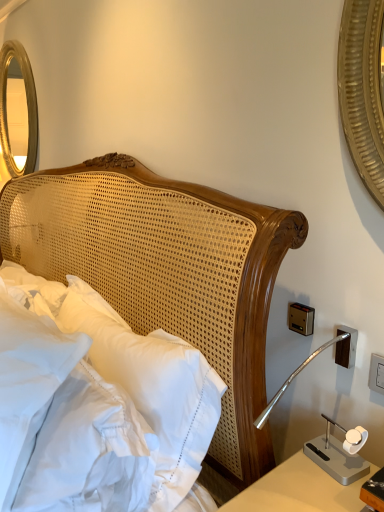
What do you see at coordinates (27, 106) in the screenshot? The height and width of the screenshot is (512, 384). I see `gold metallic mirror at upper left` at bounding box center [27, 106].

The image size is (384, 512). What do you see at coordinates (170, 273) in the screenshot?
I see `white woven headboard at center` at bounding box center [170, 273].

This screenshot has height=512, width=384. What do you see at coordinates (376, 373) in the screenshot?
I see `white plastic electric outlet at right` at bounding box center [376, 373].

At what (x,y) coordinates should I click in order to perform the action: click on gold metallic mirror at upper left. Please return your answer as a coordinate pair (x, y). Image resolution: width=384 pixels, height=512 pixels. Looking at the image, I should click on (27, 106).

Is white plastic electric outlet at right looking in the opposite direction of white woven headboard at center?

That's not correct — white plastic electric outlet at right is not looking away from white woven headboard at center.

Which object is more forward, white plastic electric outlet at right or white woven headboard at center?

white woven headboard at center is closer to the camera.

Considering the relative positions of white plastic electric outlet at right and white woven headboard at center in the image provided, is white plastic electric outlet at right to the right of white woven headboard at center from the viewer's perspective?

Correct, you'll find white plastic electric outlet at right to the right of white woven headboard at center.

Image resolution: width=384 pixels, height=512 pixels. I want to click on electric outlet behind the white woven headboard at center, so click(x=376, y=373).

Is white soft pillow at left bigger than gold metallic mirror at upper left?

Yes, white soft pillow at left is bigger than gold metallic mirror at upper left.

Is white soft pillow at left positioned before gold metallic mirror at upper left?

Yes, white soft pillow at left is closer to the viewer.

Is white soft pillow at left facing away from gold metallic mirror at upper left?

white soft pillow at left does not have its back to gold metallic mirror at upper left.

From a real-world perspective, who is located higher, white woven headboard at center or white soft pillow at left?

white soft pillow at left.

Considering the relative sizes of white woven headboard at center and white soft pillow at left in the image provided, is white woven headboard at center taller than white soft pillow at left?

Correct, white woven headboard at center is much taller as white soft pillow at left.

Is white woven headboard at center far away from white soft pillow at left?

No, white woven headboard at center is not far away from white soft pillow at left.

Considering the sizes of objects white woven headboard at center and white soft pillow at left in the image provided, who is wider, white woven headboard at center or white soft pillow at left?

With larger width is white woven headboard at center.

From the picture: Would you say white soft pillow at left is inside or outside white woven headboard at center?

white soft pillow at left cannot be found inside white woven headboard at center.

Is point (46, 317) positioned in front of point (237, 313)?

No, it is behind (237, 313).

Can you confirm if white soft pillow at left is thinner than white woven headboard at center?

Correct, the width of white soft pillow at left is less than that of white woven headboard at center.

Which is more to the left, white soft pillow at left or white woven headboard at center?

white soft pillow at left.

How far apart are white plastic electric outlet at right and gold metallic mirror at upper left?

8.16 feet.

Is white plastic electric outlet at right taller than gold metallic mirror at upper left?

Incorrect, the height of white plastic electric outlet at right is not larger of that of gold metallic mirror at upper left.

Which is more to the right, white plastic electric outlet at right or gold metallic mirror at upper left?

white plastic electric outlet at right is more to the right.

Between white plastic electric outlet at right and gold metallic mirror at upper left, which one is positioned in front?

white plastic electric outlet at right is in front.

Between gold metallic mirror at upper left and white soft pillow at left, which one has less height?

With less height is white soft pillow at left.

Is gold metallic mirror at upper left looking in the opposite direction of white soft pillow at left?

No, gold metallic mirror at upper left's orientation is not away from white soft pillow at left.

From a real-world perspective, is gold metallic mirror at upper left under white soft pillow at left?

No, from a real-world perspective, gold metallic mirror at upper left is not under white soft pillow at left.

Considering the sizes of objects gold metallic mirror at upper left and white soft pillow at left in the image provided, who is smaller, gold metallic mirror at upper left or white soft pillow at left?

gold metallic mirror at upper left is smaller.

From a real-world perspective, is white plastic electric outlet at right on top of white soft pillow at left?

Correct, in the physical world, white plastic electric outlet at right is higher than white soft pillow at left.

Can white soft pillow at left be found inside white plastic electric outlet at right?

No, white plastic electric outlet at right does not contain white soft pillow at left.

Which is further, (x=379, y=370) or (x=80, y=351)?

Positioned behind is point (x=379, y=370).

From the image's perspective, does white plastic electric outlet at right appear lower than white soft pillow at left?

Actually, white plastic electric outlet at right appears above white soft pillow at left in the image.

In the image, there is a white woven headboard at center. Where is `electric outlet above it (from the image's perspective)`? electric outlet above it (from the image's perspective) is located at coordinates 376,373.

At what (x,y) coordinates should I click in order to perform the action: click on pillow below the gold metallic mirror at upper left (from the image's perspective). Please return your answer as a coordinate pair (x, y). Looking at the image, I should click on (28, 383).

Which object lies further to the anchor point white plastic electric outlet at right, white woven headboard at center or gold metallic mirror at upper left?

gold metallic mirror at upper left is further to white plastic electric outlet at right.

Estimate the real-world distances between objects in this image. Which object is closer to gold metallic mirror at upper left, white woven headboard at center or white plastic electric outlet at right?

white woven headboard at center.

When comparing their distances from white woven headboard at center, does white plastic electric outlet at right or white soft pillow at left seem further?

white plastic electric outlet at right.

Based on their spatial positions, is white soft pillow at left or white woven headboard at center further from gold metallic mirror at upper left?

white soft pillow at left.

Which object lies further to the anchor point white soft pillow at left, white plastic electric outlet at right or white woven headboard at center?

The object further to white soft pillow at left is white plastic electric outlet at right.

When comparing their distances from gold metallic mirror at upper left, does white woven headboard at center or white soft pillow at left seem closer?

white woven headboard at center.

When comparing their distances from white woven headboard at center, does gold metallic mirror at upper left or white soft pillow at left seem closer?

white soft pillow at left.

Based on their spatial positions, is gold metallic mirror at upper left or white woven headboard at center further from white plastic electric outlet at right?

Based on the image, gold metallic mirror at upper left appears to be further to white plastic electric outlet at right.

I want to click on electric outlet between white soft pillow at left and gold metallic mirror at upper left along the z-axis, so click(376, 373).

At what (x,y) coordinates should I click in order to perform the action: click on bed between white soft pillow at left and white plastic electric outlet at right in the horizontal direction. Please return your answer as a coordinate pair (x, y). Looking at the image, I should click on (170, 273).

You are a GUI agent. You are given a task and a screenshot of the screen. Output one action in this format:
    pyautogui.click(x=<x>, y=<y>)
    Task: Click on the bed between white soft pillow at left and gold metallic mirror at upper left in the front-back direction
    Image resolution: width=384 pixels, height=512 pixels.
    Given the screenshot: What is the action you would take?
    pyautogui.click(x=170, y=273)

Identify the location of electric outlet between white woven headboard at center and gold metallic mirror at upper left from front to back. (376, 373).